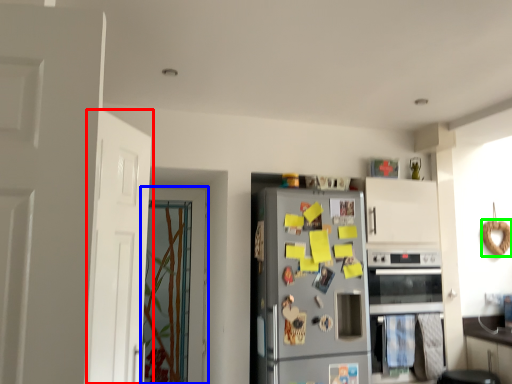
Question: Which object is positioned closest to door (highlighted by a red box)? Select from door (highlighted by a blue box) and bagel (highlighted by a green box).

Choices:
 (A) door
 (B) bagel

Answer: (A)